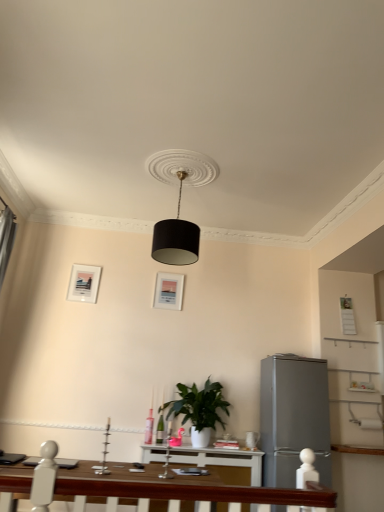
Question: Considering their positions, is matte white picture frame at upper left, arranged as the first picture frame when viewed from the left, located in front of or behind green matte plant at center?

Choices:
 (A) front
 (B) behind

Answer: (B)

Question: Is matte white picture frame at upper left, arranged as the first picture frame when viewed from the left, inside the boundaries of green matte plant at center, or outside?

Choices:
 (A) outside
 (B) inside

Answer: (A)

Question: Considering the real-world distances, which object is farthest from the matte white picture frame at upper left, arranged as the first picture frame when viewed from the left?

Choices:
 (A) black matte lampshade at center
 (B) green matte plant at center
 (C) white matte picture frame at center, positioned as the first picture frame in right-to-left order
 (D) satin silver refrigerator at right

Answer: (D)

Question: Estimate the real-world distances between objects in this image. Which object is closer to the matte white picture frame at upper left, arranged as the first picture frame when viewed from the left?

Choices:
 (A) satin silver refrigerator at right
 (B) black matte lampshade at center
 (C) green matte plant at center
 (D) white matte picture frame at center, the second picture frame when ordered from left to right

Answer: (D)